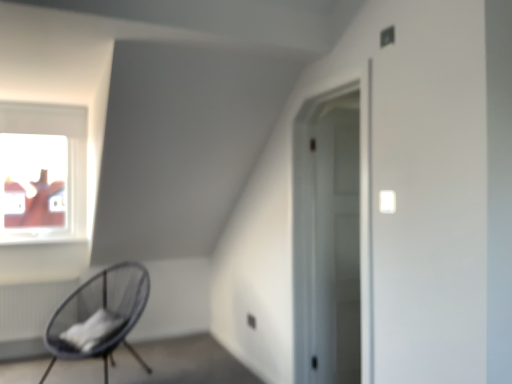
What is the approximate height of white matte door at center?

white matte door at center is 1.92 meters in height.

The width and height of the screenshot is (512, 384). In order to click on white matte door at center in this screenshot , I will do `click(336, 246)`.

Identify the location of white textured radiator at lower left. The image size is (512, 384). (31, 307).

The image size is (512, 384). What do you see at coordinates (99, 316) in the screenshot?
I see `black mesh chair at lower left` at bounding box center [99, 316].

Locate an element on the screen. This screenshot has height=384, width=512. black mesh chair at lower left is located at coordinates (99, 316).

In order to click on white matte door at center in this screenshot , I will do `click(336, 246)`.

You are a GUI agent. You are given a task and a screenshot of the screen. Output one action in this format:
    pyautogui.click(x=<x>, y=<y>)
    Task: Click on the chair lying above the white textured radiator at lower left (from the image's perspective)
    
    Given the screenshot: What is the action you would take?
    pyautogui.click(x=99, y=316)

Is black mesh chair at lower left next to white textured radiator at lower left and touching it?

No, black mesh chair at lower left is not beside white textured radiator at lower left.

Who is more distant, black mesh chair at lower left or white textured radiator at lower left?

Positioned behind is white textured radiator at lower left.

From the image's perspective, is black mesh chair at lower left above or below white textured radiator at lower left?

Based on their image positions, black mesh chair at lower left is located above white textured radiator at lower left.

Considering the sizes of black mesh chair at lower left and white matte door at center in the image, is black mesh chair at lower left taller or shorter than white matte door at center?

In the image, black mesh chair at lower left appears to be shorter than white matte door at center.

Which object is thinner, black mesh chair at lower left or white matte door at center?

Thinner between the two is white matte door at center.

Which object is positioned more to the left, black mesh chair at lower left or white matte door at center?

black mesh chair at lower left is more to the left.

From the image's perspective, between black mesh chair at lower left and white matte door at center, who is located below?

black mesh chair at lower left, from the image's perspective.

Is white matte door at center thinner than black mesh chair at lower left?

Indeed, white matte door at center has a lesser width compared to black mesh chair at lower left.

Where is `chair located below the white matte door at center (from the image's perspective)`? Image resolution: width=512 pixels, height=384 pixels. chair located below the white matte door at center (from the image's perspective) is located at coordinates (99, 316).

What's the angular difference between white matte door at center and black mesh chair at lower left's facing directions?

There is a 33.3-degree angle between the facing directions of white matte door at center and black mesh chair at lower left.

Can you see white matte door at center touching black mesh chair at lower left?

They are not placed beside each other.

Considering the sizes of objects white textured radiator at lower left and white matte door at center in the image provided, who is wider, white textured radiator at lower left or white matte door at center?

white textured radiator at lower left is wider.

In the image, there is a white textured radiator at lower left. At what (x,y) coordinates should I click in order to perform the action: click on door above it (from the image's perspective). Please return your answer as a coordinate pair (x, y). This screenshot has height=384, width=512. Looking at the image, I should click on (336, 246).

Considering the positions of points (11, 300) and (323, 308), is point (11, 300) farther from camera compared to point (323, 308)?

Yes, it is behind point (323, 308).

Between point (35, 306) and point (103, 324), which one is positioned in front?

The point (103, 324) is closer to the camera.

Between white textured radiator at lower left and black mesh chair at lower left, which one has more height?

black mesh chair at lower left is taller.

How distant is white textured radiator at lower left from black mesh chair at lower left?

white textured radiator at lower left and black mesh chair at lower left are 26.32 inches apart from each other.

In the image, is white textured radiator at lower left positioned in front of or behind black mesh chair at lower left?

white textured radiator at lower left is positioned farther from the viewer than black mesh chair at lower left.

Would you say white matte door at center is inside or outside white textured radiator at lower left?

white matte door at center is not enclosed by white textured radiator at lower left.

Find the location of a particular element. door on the right of white textured radiator at lower left is located at coordinates (336, 246).

Is white matte door at center bigger than white textured radiator at lower left?

No.

Considering the sizes of white matte door at center and white textured radiator at lower left in the image, is white matte door at center wider or thinner than white textured radiator at lower left?

In the image, white matte door at center appears to be more narrow than white textured radiator at lower left.

Identify the location of radiator to the left of black mesh chair at lower left. (31, 307).

The height and width of the screenshot is (384, 512). I want to click on door above the black mesh chair at lower left (from the image's perspective), so click(336, 246).

When comparing their distances from black mesh chair at lower left, does white matte door at center or white textured radiator at lower left seem further?

white matte door at center is positioned further to the anchor black mesh chair at lower left.

From the image, which object appears to be nearer to black mesh chair at lower left, white textured radiator at lower left or white matte door at center?

white textured radiator at lower left.

From the image, which object appears to be farther from white matte door at center, white textured radiator at lower left or black mesh chair at lower left?

Among the two, white textured radiator at lower left is located further to white matte door at center.

Based on the photo, based on their spatial positions, is black mesh chair at lower left or white textured radiator at lower left further from white matte door at center?

The object further to white matte door at center is white textured radiator at lower left.

Based on their spatial positions, is black mesh chair at lower left or white matte door at center closer to white textured radiator at lower left?

The object closer to white textured radiator at lower left is black mesh chair at lower left.

Based on their spatial positions, is white matte door at center or black mesh chair at lower left further from white textured radiator at lower left?

The object further to white textured radiator at lower left is white matte door at center.

The image size is (512, 384). What are the coordinates of `chair situated between white textured radiator at lower left and white matte door at center from left to right` in the screenshot? It's located at (99, 316).